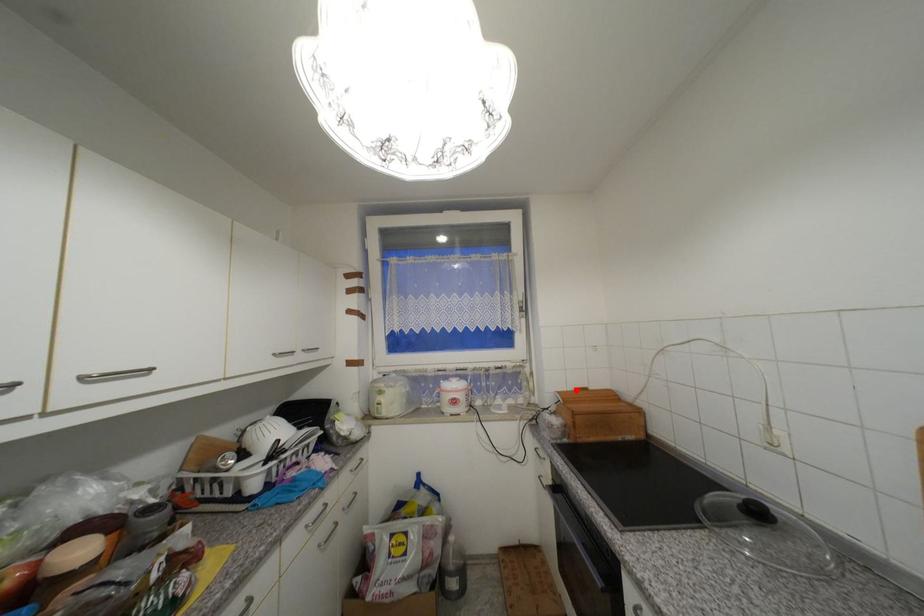
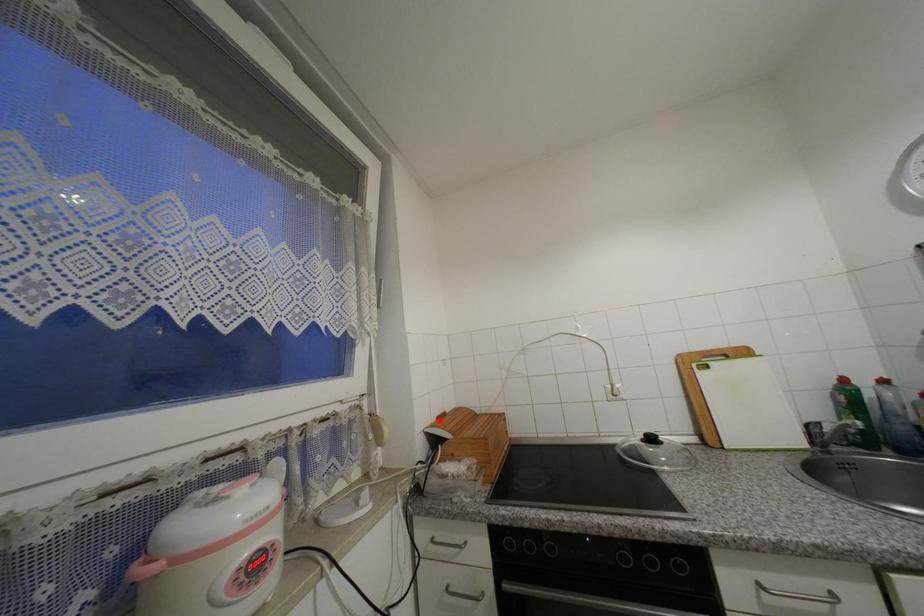
I am providing you with two images of the same scene from different viewpoints. A red point is marked on the first image and another point is marked on the second image. Are the points marked in image1 and image2 representing the same 3D position?

Yes